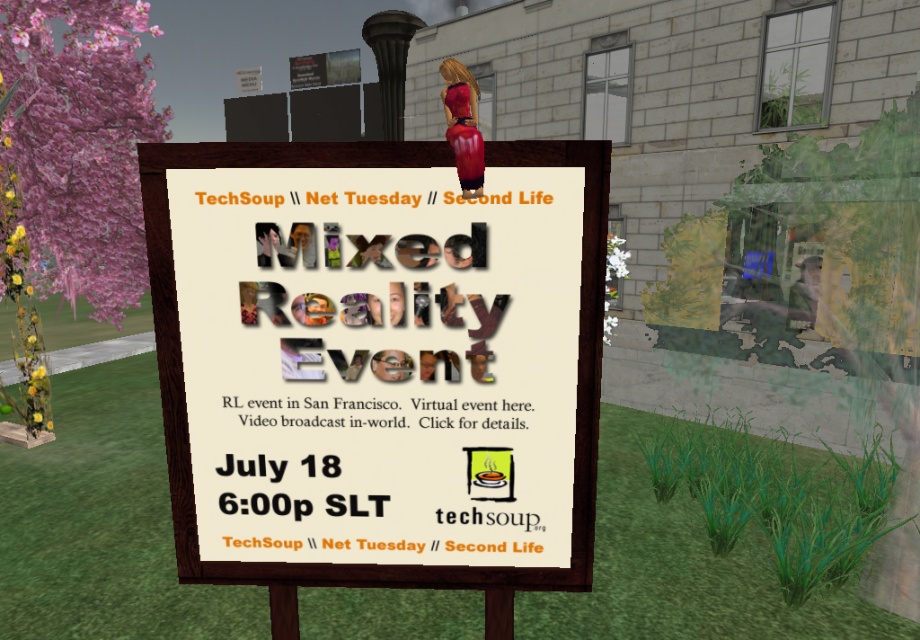
Question: Does matte paper sign at center appear on the right side of pink floral tree at left?

Choices:
 (A) yes
 (B) no

Answer: (A)

Question: Considering the relative positions of matte paper sign at center and pink floral tree at left in the image provided, where is matte paper sign at center located with respect to pink floral tree at left?

Choices:
 (A) left
 (B) right

Answer: (B)

Question: Which object appears farthest from the camera in this image?

Choices:
 (A) matte paper sign at center
 (B) pink floral tree at left
 (C) green grass at center

Answer: (B)

Question: Which object appears closest to the camera in this image?

Choices:
 (A) green grass at center
 (B) pink floral tree at left
 (C) matte paper sign at center

Answer: (C)

Question: Which object is farther from the camera taking this photo?

Choices:
 (A) green grass at center
 (B) matte paper sign at center
 (C) pink floral tree at left

Answer: (C)

Question: Does matte paper sign at center have a smaller size compared to green grass at center?

Choices:
 (A) yes
 (B) no

Answer: (A)